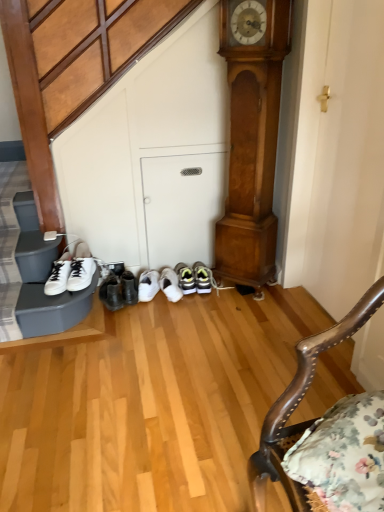
Question: Does wooden polished chair at lower right have a smaller size compared to polished wood grandfather clock at center?

Choices:
 (A) no
 (B) yes

Answer: (A)

Question: Is wooden polished chair at lower right positioned before polished wood grandfather clock at center?

Choices:
 (A) yes
 (B) no

Answer: (A)

Question: Can you confirm if wooden polished chair at lower right is taller than polished wood grandfather clock at center?

Choices:
 (A) no
 (B) yes

Answer: (A)

Question: Is wooden polished chair at lower right surrounding polished wood grandfather clock at center?

Choices:
 (A) yes
 (B) no

Answer: (B)

Question: Is wooden polished chair at lower right not inside polished wood grandfather clock at center?

Choices:
 (A) yes
 (B) no

Answer: (A)

Question: From the image's perspective, is wooden polished chair at lower right located above polished wood grandfather clock at center?

Choices:
 (A) no
 (B) yes

Answer: (A)

Question: Is white matte sneakers at left facing towards polished wood grandfather clock at center?

Choices:
 (A) yes
 (B) no

Answer: (B)

Question: Does white matte sneakers at left have a larger size compared to polished wood grandfather clock at center?

Choices:
 (A) yes
 (B) no

Answer: (B)

Question: Can you confirm if white matte sneakers at left is smaller than polished wood grandfather clock at center?

Choices:
 (A) yes
 (B) no

Answer: (A)

Question: Is the depth of white matte sneakers at left less than that of polished wood grandfather clock at center?

Choices:
 (A) yes
 (B) no

Answer: (B)

Question: Considering the relative sizes of white matte sneakers at left and polished wood grandfather clock at center in the image provided, is white matte sneakers at left wider than polished wood grandfather clock at center?

Choices:
 (A) no
 (B) yes

Answer: (B)

Question: From a real-world perspective, is white matte sneakers at left over polished wood grandfather clock at center?

Choices:
 (A) no
 (B) yes

Answer: (A)

Question: Is polished wood grandfather clock at center next to wooden polished chair at lower right and touching it?

Choices:
 (A) no
 (B) yes

Answer: (A)